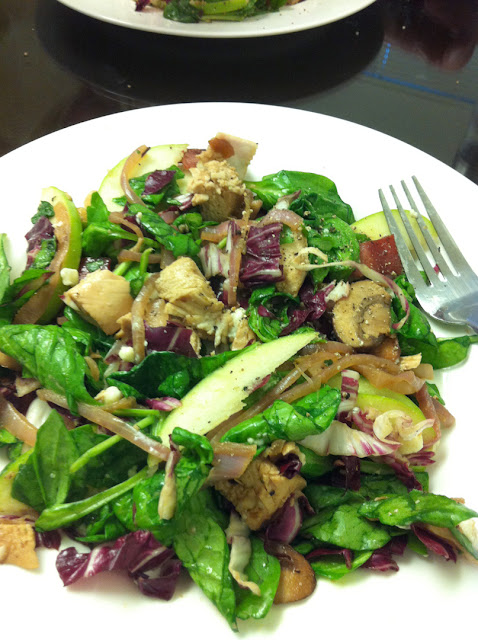
Identify the location of white plate. This screenshot has height=640, width=478. (325, 16).